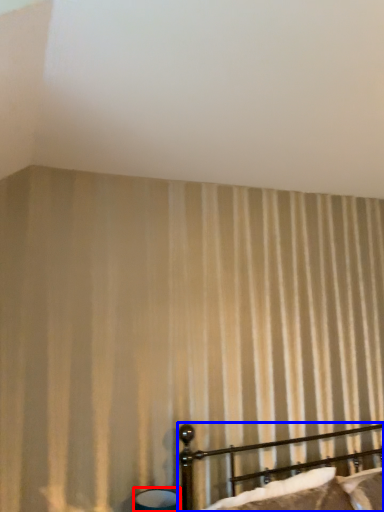
Question: Which object appears farthest to the camera in this image, table lamp (highlighted by a red box) or bed (highlighted by a blue box)?

Choices:
 (A) table lamp
 (B) bed

Answer: (A)